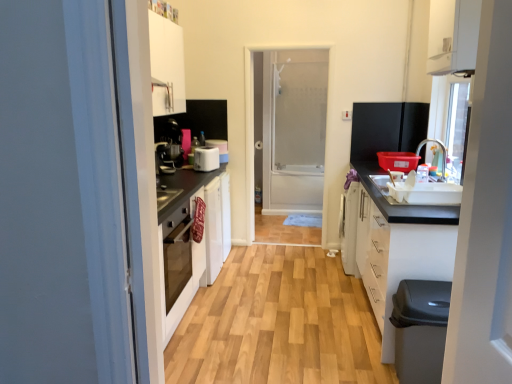
Question: Considering the relative positions of matte black coffee machine at center-left and white matte cabinet at lower right, acting as the second cabinetry starting from the top, in the image provided, is matte black coffee machine at center-left to the left of white matte cabinet at lower right, acting as the second cabinetry starting from the top, from the viewer's perspective?

Choices:
 (A) no
 (B) yes

Answer: (B)

Question: Can you confirm if matte black coffee machine at center-left is wider than white matte cabinet at lower right, acting as the second cabinetry starting from the top?

Choices:
 (A) yes
 (B) no

Answer: (B)

Question: Is matte black coffee machine at center-left taller than white matte cabinet at lower right, which appears as the first cabinetry when ordered from the bottom?

Choices:
 (A) no
 (B) yes

Answer: (A)

Question: Is matte black coffee machine at center-left facing away from white matte cabinet at lower right, acting as the second cabinetry starting from the top?

Choices:
 (A) yes
 (B) no

Answer: (B)

Question: From the image's perspective, is matte black coffee machine at center-left beneath white matte cabinet at lower right, acting as the second cabinetry starting from the top?

Choices:
 (A) yes
 (B) no

Answer: (B)

Question: Looking at their shapes, would you say white plastic toaster at center is wider or thinner than black plastic dishwasher at lower right?

Choices:
 (A) thin
 (B) wide

Answer: (A)

Question: Based on their sizes in the image, would you say white plastic toaster at center is bigger or smaller than black plastic dishwasher at lower right?

Choices:
 (A) big
 (B) small

Answer: (B)

Question: From the image's perspective, is white plastic toaster at center positioned above or below black plastic dishwasher at lower right?

Choices:
 (A) above
 (B) below

Answer: (A)

Question: Is white plastic toaster at center in front of or behind black plastic dishwasher at lower right in the image?

Choices:
 (A) front
 (B) behind

Answer: (B)

Question: Is point (280, 170) positioned closer to the camera than point (267, 322)?

Choices:
 (A) farther
 (B) closer

Answer: (A)

Question: Based on their positions, is transparent glass screen door at center located to the left or right of wooden floor at center?

Choices:
 (A) right
 (B) left

Answer: (A)

Question: In the image, is transparent glass screen door at center positioned in front of or behind wooden floor at center?

Choices:
 (A) front
 (B) behind

Answer: (B)

Question: Considering the positions of transparent glass screen door at center and wooden floor at center in the image, is transparent glass screen door at center wider or thinner than wooden floor at center?

Choices:
 (A) wide
 (B) thin

Answer: (B)

Question: Considering the relative positions of matte black coffee machine at center-left and black plastic dishwasher at lower right in the image provided, is matte black coffee machine at center-left to the left or to the right of black plastic dishwasher at lower right?

Choices:
 (A) left
 (B) right

Answer: (A)

Question: Is matte black coffee machine at center-left bigger or smaller than black plastic dishwasher at lower right?

Choices:
 (A) big
 (B) small

Answer: (B)